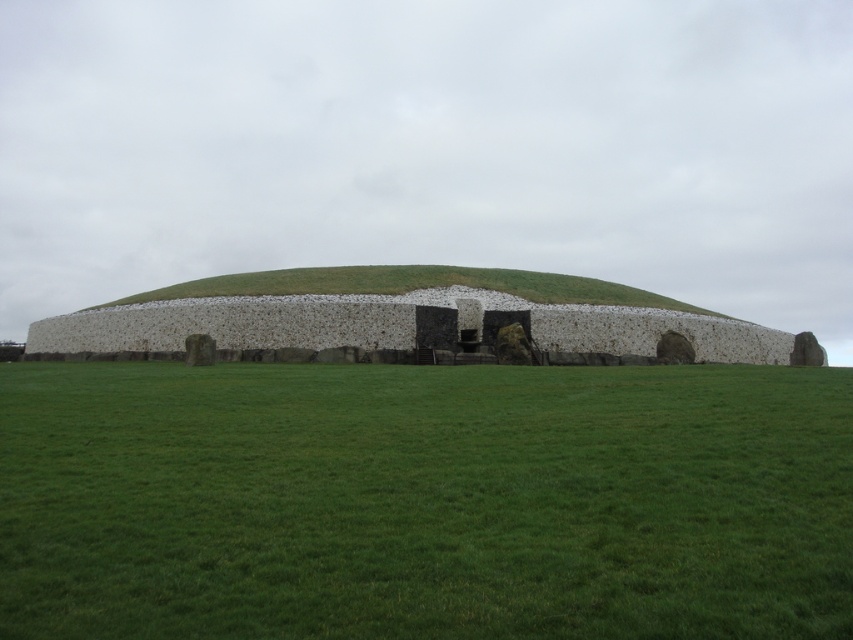
You are standing at the entrance of the ancient burial mound and want to reach the point marked as point (209, 396). However, there is an obstacle at point (486, 275) blocking your path. Can you safely navigate around the obstacle to reach your destination?

Yes, you can safely navigate around the obstacle because point (209, 396) is in front of point (486, 275), meaning the destination is closer to you than the obstacle, allowing you to move past it without obstruction.

You are a drone operator tasked with capturing aerial footage of the burial mound. Your drone has a maximum flight range of 35 meters from its starting position. If you position yourself at the green grass at center, can your drone reach the green grassy mound at center without exceeding its range?

The green grass at center and green grassy mound at center are 37.32 meters apart from each other. Since the drone has a maximum range of 35 meters, it cannot reach the green grassy mound at center from the green grass at center.